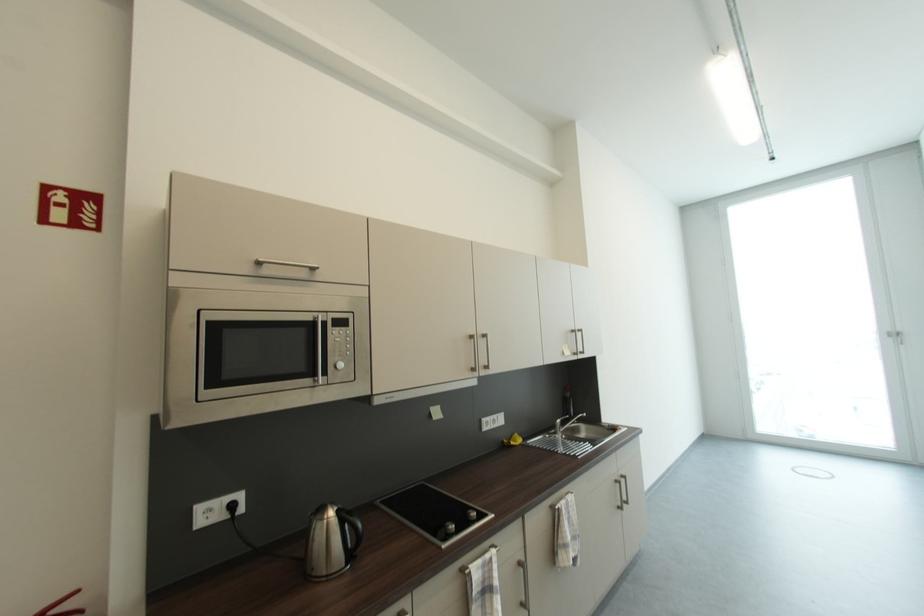
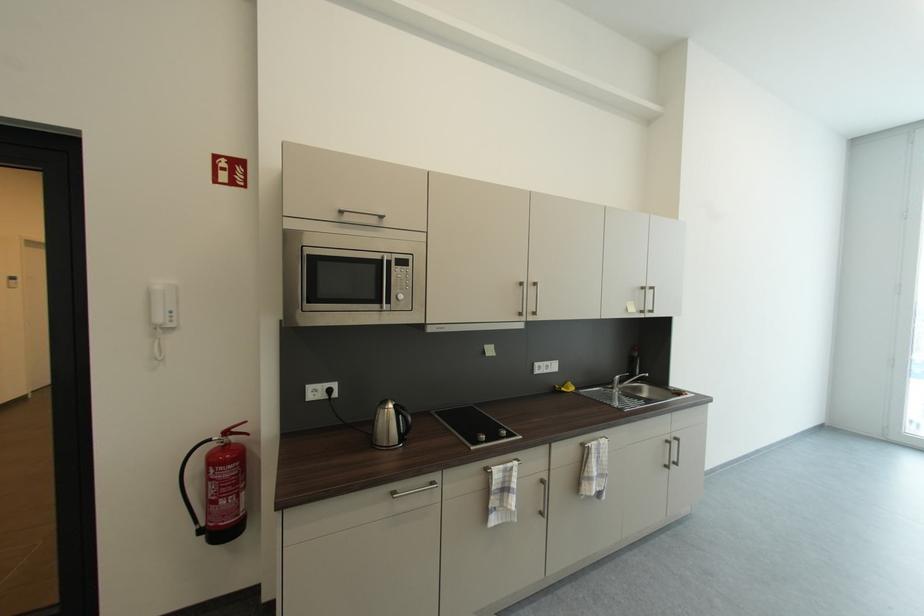
In the second image, find the point that corresponds to [345,341] in the first image.

(407, 278)